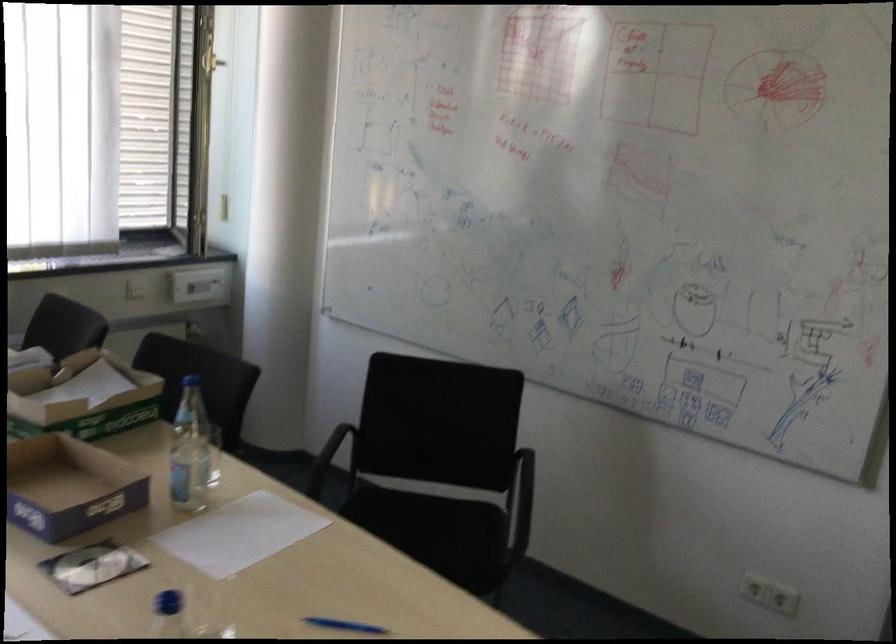
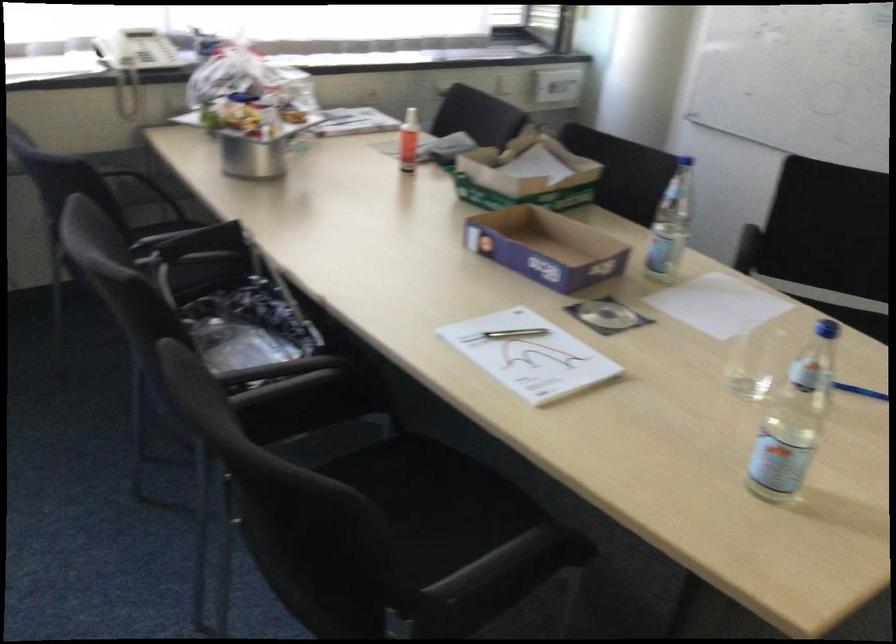
Question: The camera is either moving clockwise (left) or counter-clockwise (right) around the object. The first image is from the beginning of the video and the second image is from the end. Is the camera moving left or right when shooting the video?

Choices:
 (A) Left
 (B) Right

Answer: (B)